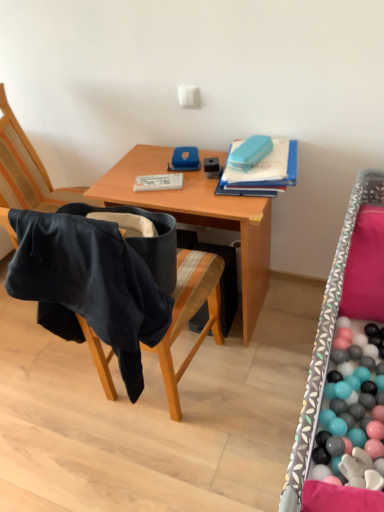
Identify the location of vacant region in front of black fabric chair at left. The width and height of the screenshot is (384, 512). (164, 466).